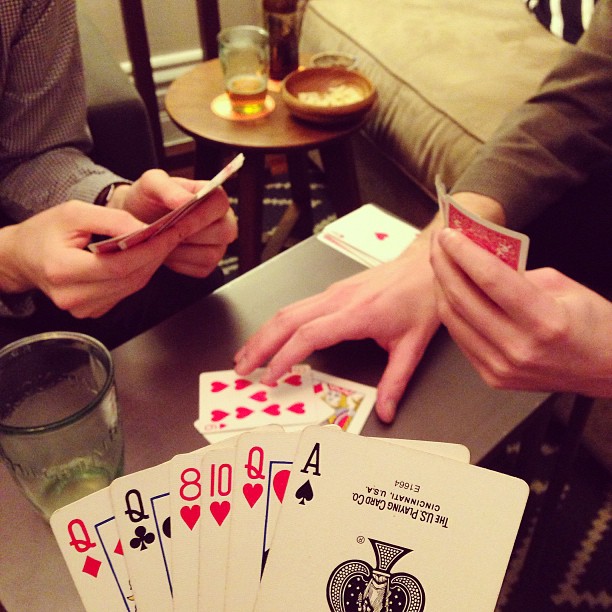
Identify the location of table top. (136, 409).